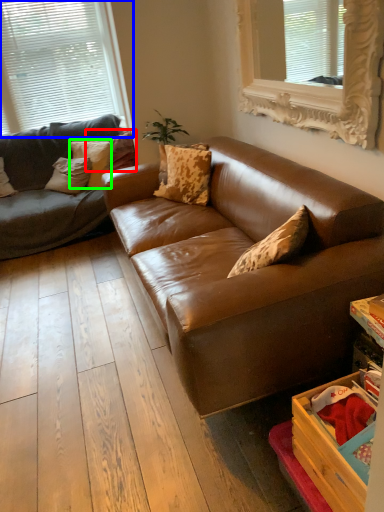
Question: Which object is positioned closest to pillow (highlighted by a red box)? Select from window (highlighted by a blue box) and pillow (highlighted by a green box).

Choices:
 (A) window
 (B) pillow

Answer: (B)